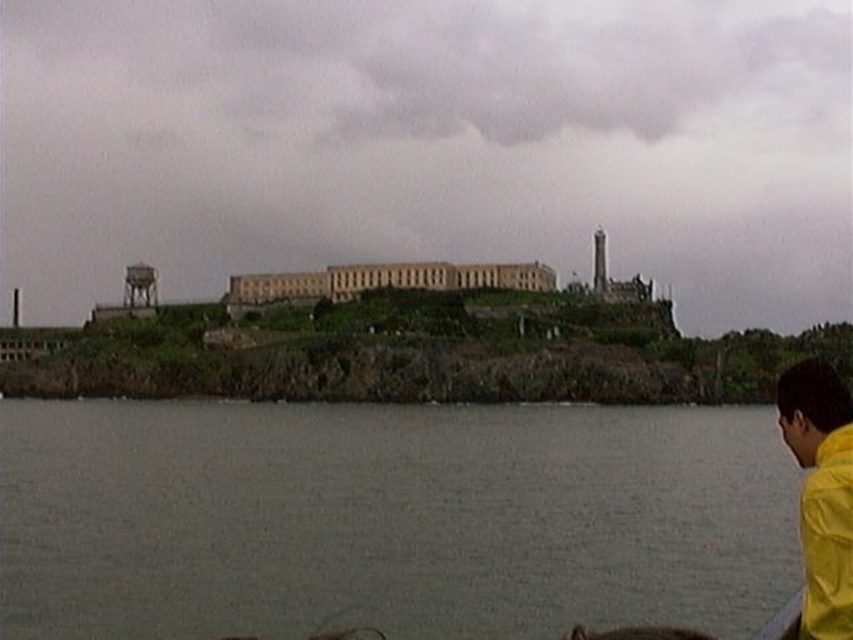
Does point (70, 467) come in front of point (788, 404)?

No, it is behind (788, 404).

Is gray water at lower center shorter than yellow matte jacket at lower right?

Yes.

Does point (689, 536) come behind point (817, 584)?

Yes.

The height and width of the screenshot is (640, 853). I want to click on gray water at lower center, so click(x=387, y=518).